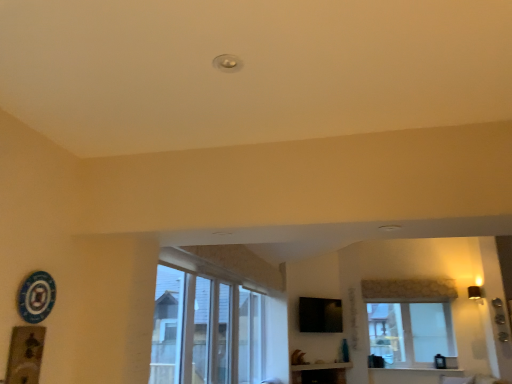
What do you see at coordinates (417, 370) in the screenshot?
I see `white textured wood at lower center` at bounding box center [417, 370].

Image resolution: width=512 pixels, height=384 pixels. I want to click on white glass window at center, so click(x=410, y=320).

The width and height of the screenshot is (512, 384). In order to click on white textured wood at lower center in this screenshot , I will do `click(417, 370)`.

Considering the positions of objects black glossy tv at upper center and white glass window at center in the image provided, who is behind, black glossy tv at upper center or white glass window at center?

white glass window at center is further away from the camera.

Based on the photo, does black glossy tv at upper center have a greater height compared to white glass window at center?

No, black glossy tv at upper center is not taller than white glass window at center.

Is point (377, 351) in front of point (318, 304)?

Yes, it is in front of point (318, 304).

From their relative heights in the image, would you say white glass window at center is taller or shorter than black glossy tv at upper center?

Considering their sizes, white glass window at center has more height than black glossy tv at upper center.

Which of these two, white glass window at center or black glossy tv at upper center, is bigger?

white glass window at center.

From the image's perspective, which one is positioned higher, white glass window at center or white textured wood at lower center?

From the image's view, white glass window at center is above.

From a real-world perspective, who is located lower, white glass window at center or white textured wood at lower center?

From a 3D spatial view, white textured wood at lower center is below.

Can you tell me how much white glass window at center and white textured wood at lower center differ in facing direction?

0.231 degrees separate the facing orientations of white glass window at center and white textured wood at lower center.

Is white textured wood at lower center situated inside black glossy tv at upper center or outside?

white textured wood at lower center is not inside black glossy tv at upper center, it's outside.

Who is more distant, white textured wood at lower center or black glossy tv at upper center?

white textured wood at lower center is further away from the camera.

From the image's perspective, which is below, white textured wood at lower center or black glossy tv at upper center?

white textured wood at lower center is shown below in the image.

Does white textured wood at lower center have a smaller size compared to black glossy tv at upper center?

Yes, white textured wood at lower center is smaller than black glossy tv at upper center.

Between white textured wood at lower center and white glass window at center, which one has more height?

white glass window at center.

Which of these two, white textured wood at lower center or white glass window at center, is smaller?

white textured wood at lower center.

What's the angular difference between white textured wood at lower center and white glass window at center's facing directions?

The angular difference between white textured wood at lower center and white glass window at center is 0.231 degrees.

Is white textured wood at lower center looking in the opposite direction of white glass window at center?

white textured wood at lower center does not have its back to white glass window at center.

Is there a large distance between black glossy tv at upper center and white textured wood at lower center?

That's right, there is a large distance between black glossy tv at upper center and white textured wood at lower center.

Which is less distant, [336,320] or [434,372]?

Point [336,320] appears to be farther away from the viewer than point [434,372].

Does black glossy tv at upper center have a greater height compared to white textured wood at lower center?

Yes, black glossy tv at upper center is taller than white textured wood at lower center.

At what (x,y) coordinates should I click in order to perform the action: click on window screen above the white glass window at center (from the image's perspective). Please return your answer as a coordinate pair (x, y). The height and width of the screenshot is (384, 512). Looking at the image, I should click on (320, 315).

Image resolution: width=512 pixels, height=384 pixels. Find the location of `window lying below the black glossy tv at upper center (from the image's perspective)`. window lying below the black glossy tv at upper center (from the image's perspective) is located at coordinates (410, 320).

Estimate the real-world distances between objects in this image. Which object is further from white textured wood at lower center, black glossy tv at upper center or white glass window at center?

black glossy tv at upper center is positioned further to the anchor white textured wood at lower center.

Based on their spatial positions, is white glass window at center or white textured wood at lower center closer to black glossy tv at upper center?

Among the two, white glass window at center is located nearer to black glossy tv at upper center.

In the scene shown: Estimate the real-world distances between objects in this image. Which object is closer to black glossy tv at upper center, white textured wood at lower center or white glass window at center?

Based on the image, white glass window at center appears to be nearer to black glossy tv at upper center.

Which object lies further to the anchor point white glass window at center, white textured wood at lower center or black glossy tv at upper center?

black glossy tv at upper center.

Based on their spatial positions, is white glass window at center or black glossy tv at upper center closer to white textured wood at lower center?

Based on the image, white glass window at center appears to be nearer to white textured wood at lower center.

Which object lies further to the anchor point white glass window at center, black glossy tv at upper center or white textured wood at lower center?

Based on the image, black glossy tv at upper center appears to be further to white glass window at center.

Locate an element on the screen. This screenshot has width=512, height=384. window located between black glossy tv at upper center and white textured wood at lower center in the left-right direction is located at coordinates (410, 320).